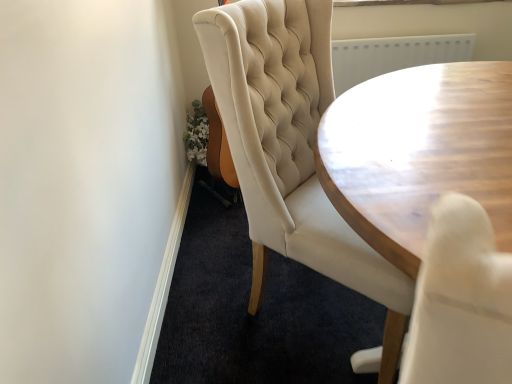
This screenshot has width=512, height=384. What are the coordinates of `wooden table at center` in the screenshot? It's located at (419, 152).

The height and width of the screenshot is (384, 512). What do you see at coordinates (419, 152) in the screenshot? I see `wooden table at center` at bounding box center [419, 152].

Measure the distance between point (x=440, y=150) and camera.

36.85 inches.

In order to face tufted cream chair at center, should I rotate leftwards or rightwards?

To align with it, rotate right about 11.247°.

This screenshot has height=384, width=512. Describe the element at coordinates (292, 152) in the screenshot. I see `tufted cream chair at center` at that location.

This screenshot has width=512, height=384. In order to click on tufted cream chair at center in this screenshot , I will do `click(292, 152)`.

In order to click on wooden table at center in this screenshot , I will do `click(419, 152)`.

Considering the relative positions of wooden table at center and tufted cream chair at center in the image provided, is wooden table at center to the left of tufted cream chair at center from the viewer's perspective?

No.

Between wooden table at center and tufted cream chair at center, which one is positioned behind?

tufted cream chair at center is further away from the camera.

Which point is more distant from viewer, (490, 182) or (300, 95)?

The point (300, 95) is behind.

From the image's perspective, is wooden table at center on tufted cream chair at center?

No.

From a real-world perspective, who is located higher, wooden table at center or tufted cream chair at center?

wooden table at center.

Can you confirm if wooden table at center is wider than tufted cream chair at center?

Yes, wooden table at center is wider than tufted cream chair at center.

Is wooden table at center taller than tufted cream chair at center?

Yes.

Considering the sizes of objects wooden table at center and tufted cream chair at center in the image provided, who is bigger, wooden table at center or tufted cream chair at center?

With larger size is tufted cream chair at center.

Based on the photo, is tufted cream chair at center surrounded by wooden table at center?

No, tufted cream chair at center is not a part of wooden table at center.

Is wooden table at center positioned far away from tufted cream chair at center?

No.

Is wooden table at center turned away from tufted cream chair at center?

No, wooden table at center is not facing away from tufted cream chair at center.

How many degrees apart are the facing directions of wooden table at center and tufted cream chair at center?

wooden table at center and tufted cream chair at center are facing 95.3 degrees away from each other.

Identify the location of coffee table below the tufted cream chair at center (from the image's perspective). This screenshot has width=512, height=384. (419, 152).

Would you say tufted cream chair at center is to the left or to the right of wooden table at center in the picture?

Clearly, tufted cream chair at center is on the left of wooden table at center in the image.

Considering the relative positions of tufted cream chair at center and wooden table at center in the image provided, is tufted cream chair at center behind wooden table at center?

Yes.

Which point is more forward, (400,315) or (386,137)?

Point (386,137)

From the image's perspective, is tufted cream chair at center beneath wooden table at center?

No, from the image's perspective, tufted cream chair at center is not below wooden table at center.

From a real-world perspective, is tufted cream chair at center physically below wooden table at center?

Yes, from a real-world perspective, tufted cream chair at center is below wooden table at center.

Does tufted cream chair at center have a greater width compared to wooden table at center?

No, tufted cream chair at center is not wider than wooden table at center.

Considering the sizes of objects tufted cream chair at center and wooden table at center in the image provided, who is taller, tufted cream chair at center or wooden table at center?

With more height is wooden table at center.

Is tufted cream chair at center bigger than wooden table at center?

Yes, tufted cream chair at center is bigger than wooden table at center.

Choose the correct answer: Is tufted cream chair at center inside wooden table at center or outside it?

The correct answer is: outside.

Does tufted cream chair at center touch wooden table at center?

They are not placed beside each other.

Is tufted cream chair at center oriented away from wooden table at center?

No.

How much distance is there between tufted cream chair at center and wooden table at center?

tufted cream chair at center and wooden table at center are 11.69 inches apart.

Identify the location of coffee table that appears above the tufted cream chair at center (from a real-world perspective). This screenshot has width=512, height=384. (419, 152).

The width and height of the screenshot is (512, 384). I want to click on chair below the wooden table at center (from a real-world perspective), so click(x=292, y=152).

At what (x,y) coordinates should I click in order to perform the action: click on chair behind the wooden table at center. Please return your answer as a coordinate pair (x, y). Looking at the image, I should click on (292, 152).